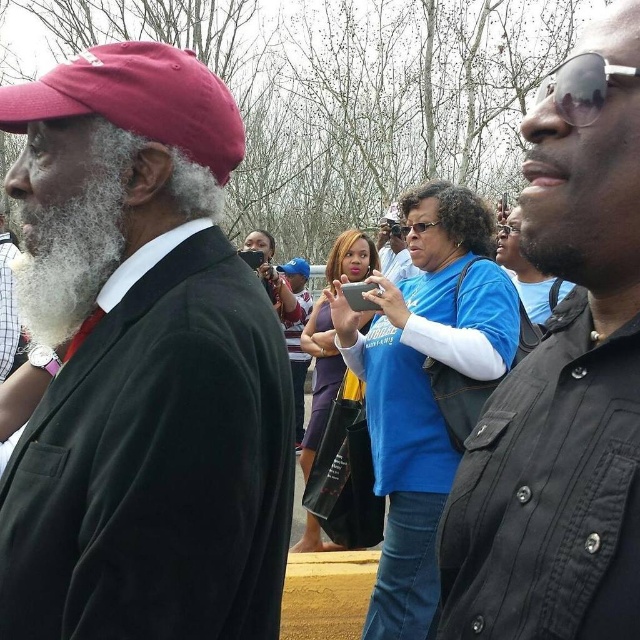
You are a photographer trying to capture both the matte red cap at left and the black matte shirt at right in a single shot. Which object should you focus on first to ensure both are in clear focus?

You should focus on the matte red cap at left first since it is closer to you than the black matte shirt at right, ensuring both will be in focus when using depth of field appropriately.

You are a photographer trying to capture a closeup shot of both the blue fabric baseball cap at center and the clear plastic goggles at center. Since you want to focus on one object at a time, which object should you adjust your camera focus to first if you want to avoid refocusing when switching between them?

The blue fabric baseball cap at center is thinner than clear plastic goggles at center. Since the blue fabric baseball cap at center has a smaller depth of field, you should focus on it first before moving to the clear plastic goggles at center to maintain sharpness without needing to refocus.